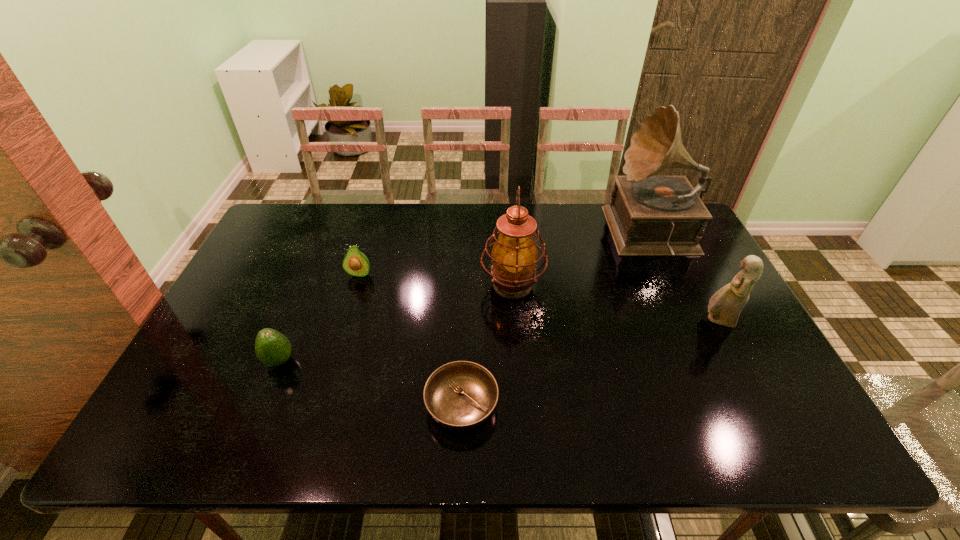
The width and height of the screenshot is (960, 540). What are the coordinates of `free space located from the horn of the tallest object` in the screenshot? It's located at (504, 235).

The height and width of the screenshot is (540, 960). Identify the location of free location located 0.150m from the horn of the tallest object. tap(567, 235).

This screenshot has height=540, width=960. I want to click on vacant space located 0.170m from the horn of the tallest object, so click(x=561, y=235).

Identify the location of blank space located 0.100m on the back of the oil lamp. (510, 244).

I want to click on free spot located on the front-facing side of the figurine, so click(596, 321).

This screenshot has width=960, height=540. Find the location of `vacant space situated 0.270m on the front-facing side of the figurine`. vacant space situated 0.270m on the front-facing side of the figurine is located at coordinates (604, 321).

This screenshot has width=960, height=540. I want to click on vacant space located 0.120m on the front-facing side of the figurine, so click(659, 321).

Image resolution: width=960 pixels, height=540 pixels. Identify the location of vacant space located 0.210m on the cut side of the farther avocado. (342, 334).

This screenshot has height=540, width=960. What are the coordinates of `vacant space situated 0.120m on the left of the leftmost object` in the screenshot? It's located at (215, 361).

You are a GUI agent. You are given a task and a screenshot of the screen. Output one action in this format:
    pyautogui.click(x=<x>, y=<y>)
    Task: Click on the free space located on the left of the nearest object
    The width and height of the screenshot is (960, 540).
    Given the screenshot: What is the action you would take?
    pyautogui.click(x=304, y=406)